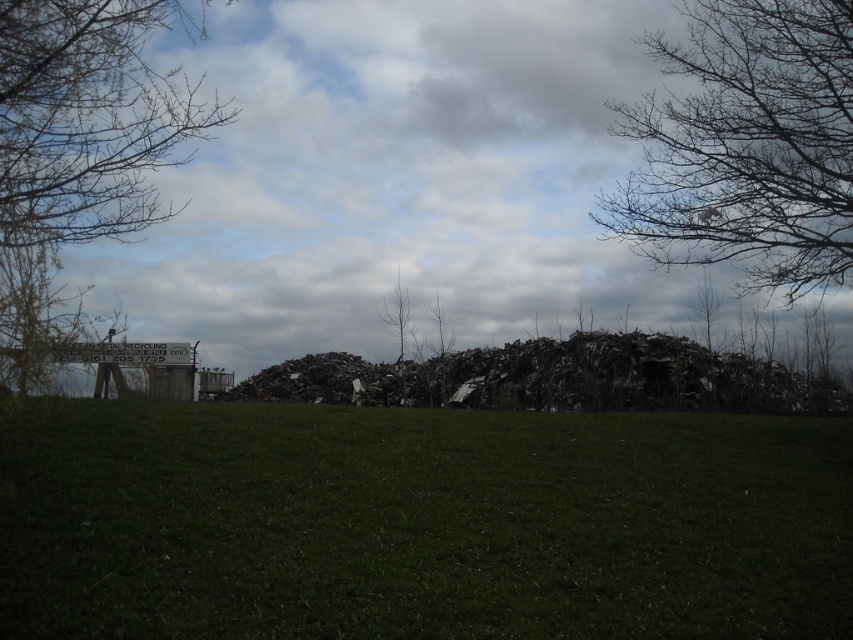
Question: Does bare branches at upper left have a larger size compared to dark metallic debris at center?

Choices:
 (A) no
 (B) yes

Answer: (B)

Question: Estimate the real-world distances between objects in this image. Which object is farther from the bare branches at upper left?

Choices:
 (A) bare branch tree at center
 (B) dark metallic debris at center
 (C) green grassy field at lower center
 (D) bare branches at upper right

Answer: (D)

Question: Is green grassy field at lower center smaller than bare branch tree at center?

Choices:
 (A) yes
 (B) no

Answer: (B)

Question: Which point appears closest to the camera in this image?

Choices:
 (A) (399, 336)
 (B) (128, 52)
 (C) (645, 387)

Answer: (B)

Question: Which object is positioned farthest from the green grassy field at lower center?

Choices:
 (A) dark metallic debris at center
 (B) bare branches at upper right
 (C) bare branches at upper left
 (D) bare branch tree at center

Answer: (D)

Question: Does bare branches at upper right appear on the right side of dark metallic debris at center?

Choices:
 (A) no
 (B) yes

Answer: (B)